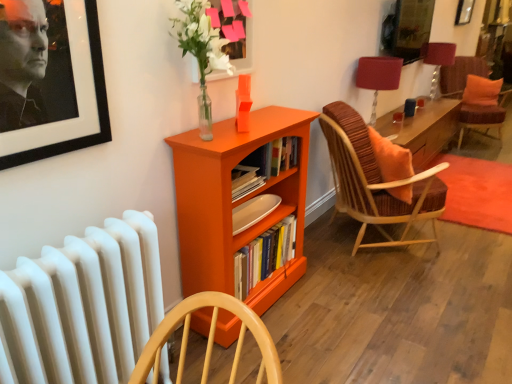
Where is `free area below wooden woven chair with orange cushion at right, the 1th chair positioned from the left (from a real-world perspective)`? free area below wooden woven chair with orange cushion at right, the 1th chair positioned from the left (from a real-world perspective) is located at coordinates (354, 240).